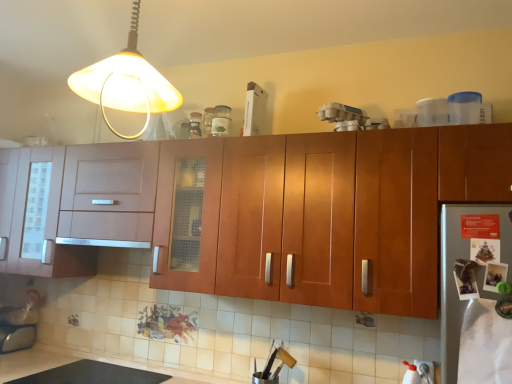
Question: Should I look upward or downward to see matte glass bottle at upper center, acting as the 2th bottle starting from the right?

Choices:
 (A) up
 (B) down

Answer: (A)

Question: From a real-world perspective, is satin silver exhaust hood at center located higher than matte glass bottle at upper center, which is the first bottle in left-to-right order?

Choices:
 (A) yes
 (B) no

Answer: (B)

Question: From the image's perspective, is satin silver exhaust hood at center beneath matte glass bottle at upper center, acting as the 2th bottle starting from the right?

Choices:
 (A) yes
 (B) no

Answer: (A)

Question: From a real-world perspective, is satin silver exhaust hood at center below matte glass bottle at upper center, acting as the 2th bottle starting from the right?

Choices:
 (A) no
 (B) yes

Answer: (B)

Question: Is satin silver exhaust hood at center thinner than matte glass bottle at upper center, acting as the 2th bottle starting from the right?

Choices:
 (A) yes
 (B) no

Answer: (B)

Question: Are satin silver exhaust hood at center and matte glass bottle at upper center, acting as the 2th bottle starting from the right, far apart?

Choices:
 (A) no
 (B) yes

Answer: (A)

Question: Does satin silver exhaust hood at center appear on the left side of matte glass bottle at upper center, which is the first bottle in left-to-right order?

Choices:
 (A) no
 (B) yes

Answer: (B)

Question: Is satin silver exhaust hood at center oriented away from clear glass jar at upper center, acting as the 2th bottle starting from the left?

Choices:
 (A) yes
 (B) no

Answer: (B)

Question: From a real-world perspective, is satin silver exhaust hood at center positioned over clear glass jar at upper center, which ranks as the 1th bottle in right-to-left order, based on gravity?

Choices:
 (A) no
 (B) yes

Answer: (A)

Question: Is satin silver exhaust hood at center to the left of clear glass jar at upper center, which ranks as the 1th bottle in right-to-left order, from the viewer's perspective?

Choices:
 (A) yes
 (B) no

Answer: (A)

Question: Considering the relative sizes of satin silver exhaust hood at center and clear glass jar at upper center, acting as the 2th bottle starting from the left, in the image provided, is satin silver exhaust hood at center bigger than clear glass jar at upper center, acting as the 2th bottle starting from the left,?

Choices:
 (A) yes
 (B) no

Answer: (A)

Question: Does satin silver exhaust hood at center have a greater width compared to clear glass jar at upper center, acting as the 2th bottle starting from the left?

Choices:
 (A) no
 (B) yes

Answer: (B)

Question: From the image's perspective, is satin silver exhaust hood at center above clear glass jar at upper center, which ranks as the 1th bottle in right-to-left order?

Choices:
 (A) no
 (B) yes

Answer: (A)

Question: Is matte glass bottle at upper center, acting as the 2th bottle starting from the right, in contact with matte yellow plastic lampshade at upper left?

Choices:
 (A) no
 (B) yes

Answer: (A)